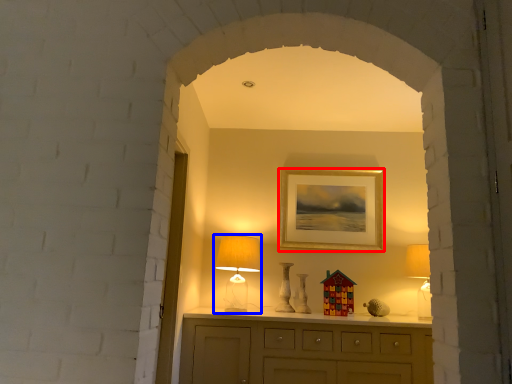
Question: Which object appears closest to the camera in this image, picture frame (highlighted by a red box) or table lamp (highlighted by a blue box)?

Choices:
 (A) picture frame
 (B) table lamp

Answer: (B)